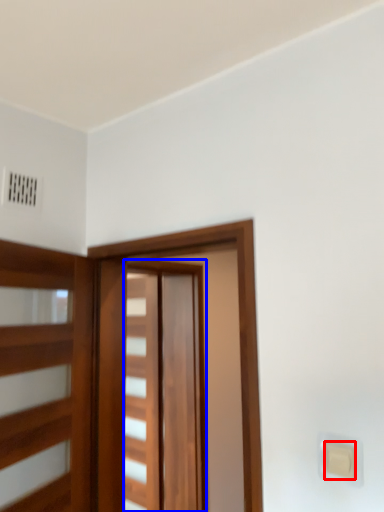
Question: Which of the following is the closest to the observer, light switch (highlighted by a red box) or barn door (highlighted by a blue box)?

Choices:
 (A) light switch
 (B) barn door

Answer: (A)